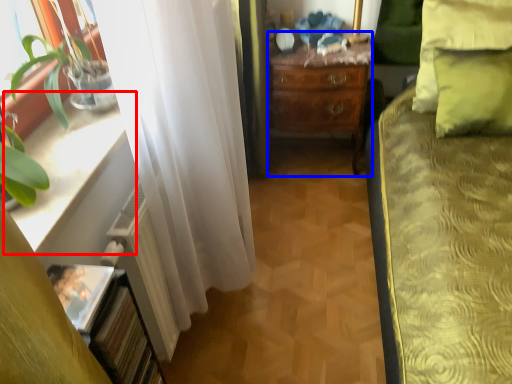
Question: Which object is further to the camera taking this photo, window sill (highlighted by a red box) or desk (highlighted by a blue box)?

Choices:
 (A) window sill
 (B) desk

Answer: (B)